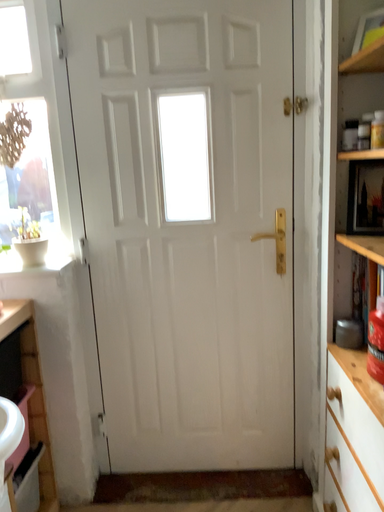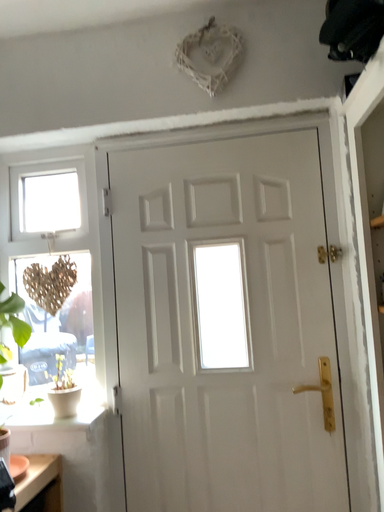
Question: How did the camera likely rotate when shooting the video?

Choices:
 (A) rotated upward
 (B) rotated downward

Answer: (A)